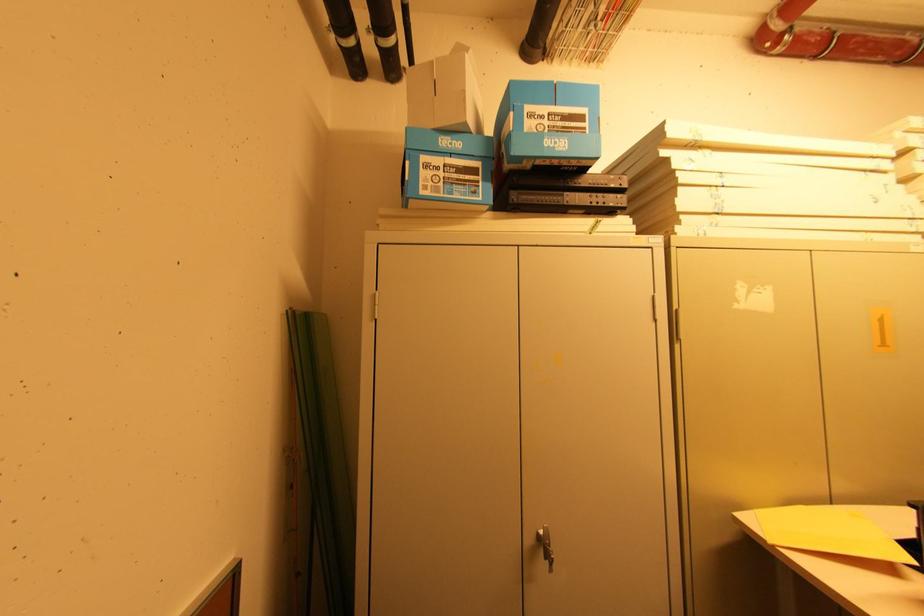
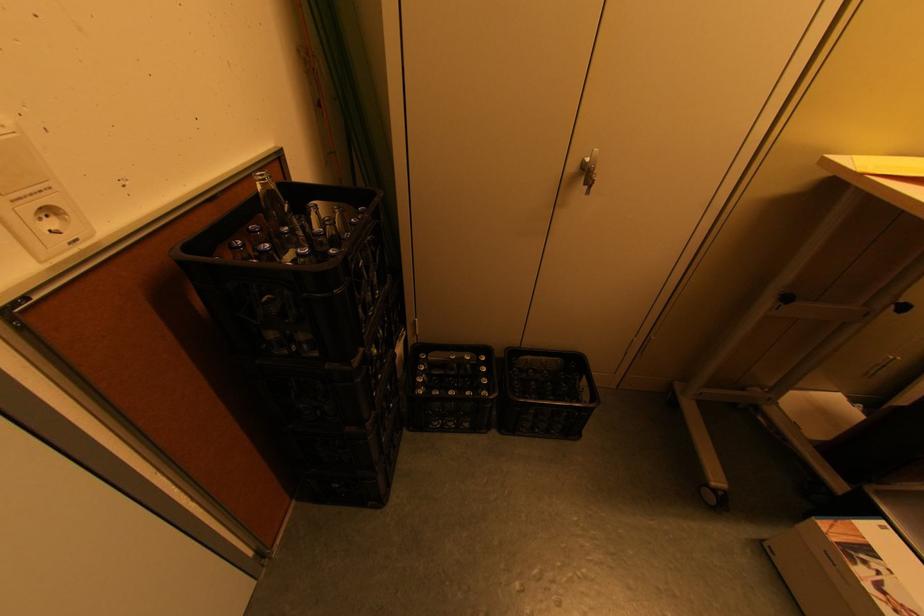
In the second image, find the point that corresponds to point 541,533 in the first image.

(587, 161)